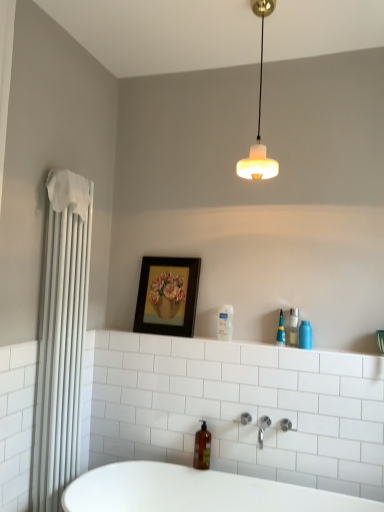
Identify the location of free space above wooden framed painting at center (from a real-world perspective). This screenshot has height=512, width=384. (177, 245).